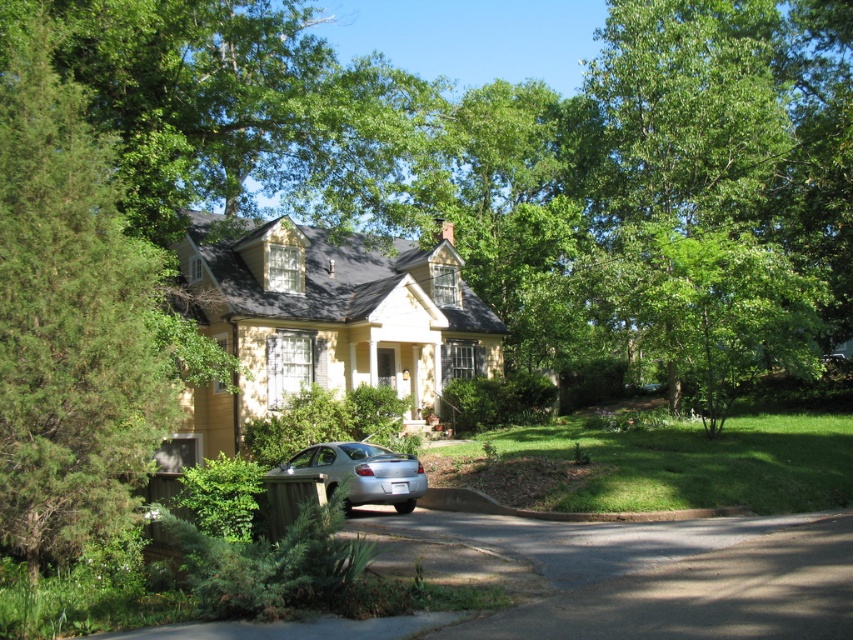
Question: Can you confirm if black asphalt driveway at lower center is positioned to the right of brown concrete curb at lower center?

Choices:
 (A) no
 (B) yes

Answer: (A)

Question: Does black asphalt driveway at lower center have a lesser width compared to silver metallic sedan at lower left?

Choices:
 (A) no
 (B) yes

Answer: (A)

Question: Based on their relative distances, which object is farther from the silver metallic sedan at lower left?

Choices:
 (A) black asphalt driveway at lower center
 (B) brown concrete curb at lower center

Answer: (A)

Question: Can you confirm if green textured tree at left is positioned below brown concrete curb at lower center?

Choices:
 (A) yes
 (B) no

Answer: (B)

Question: Among these objects, which one is nearest to the camera?

Choices:
 (A) black asphalt driveway at lower center
 (B) silver metallic sedan at lower left

Answer: (A)

Question: Estimate the real-world distances between objects in this image. Which object is closer to the black asphalt driveway at lower center?

Choices:
 (A) green textured tree at left
 (B) brown concrete curb at lower center

Answer: (B)